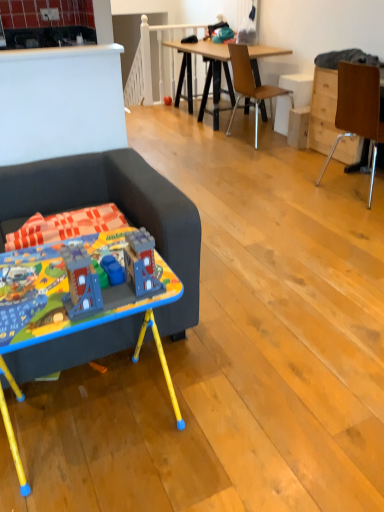
This screenshot has width=384, height=512. I want to click on free area in between wooden drawer at right and blue plastic desk at lower left, so click(269, 223).